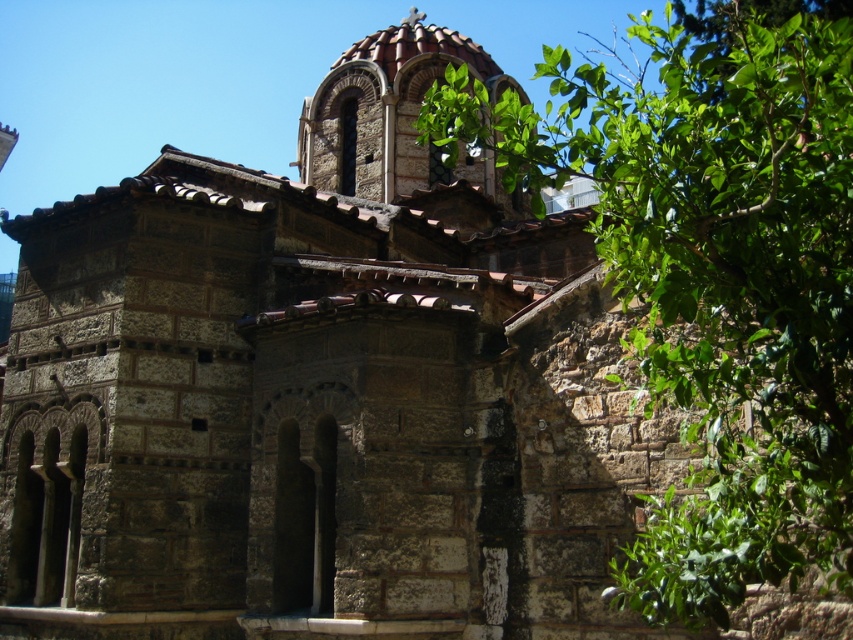
You are a photographer standing in front of the ancient stone church. You want to capture a photo that includes both the green leafy tree at upper right and the brown stone dome at upper center. Which object will appear larger in the photo?

The green leafy tree at upper right will appear larger in the photo because it is much taller than the brown stone dome at upper center.

You are standing in front of the ancient stone church and notice a green leafy tree at upper right and a brown stone dome at upper center. Which object is positioned closer to you?

The green leafy tree at upper right is closer to the viewer than the brown stone dome at upper center.